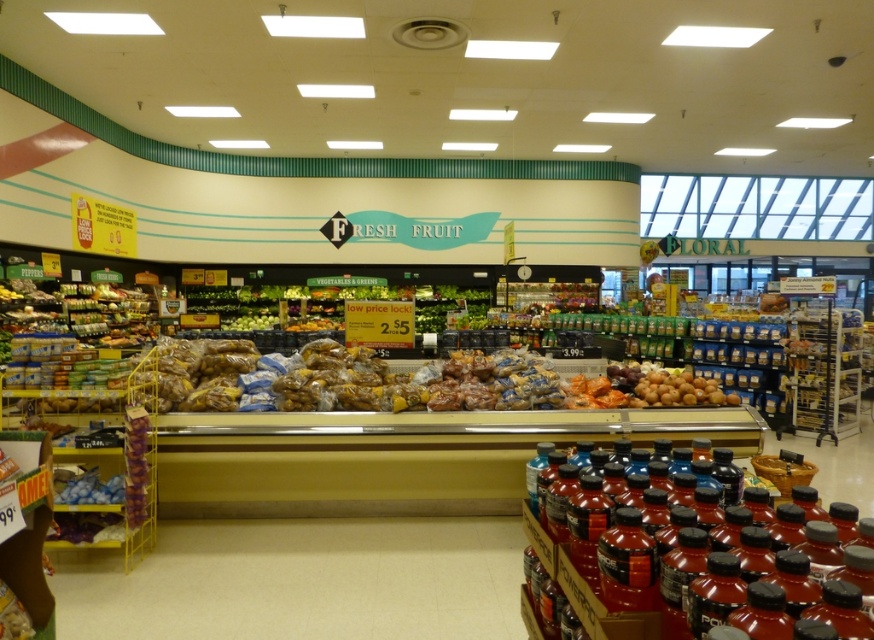
Which is more to the right, shiny red plastic bottles at lower right or shiny blue jelly beans at lower left?

Positioned to the right is shiny red plastic bottles at lower right.

Is shiny red plastic bottles at lower right to the right of shiny blue jelly beans at lower left from the viewer's perspective?

Yes, shiny red plastic bottles at lower right is to the right of shiny blue jelly beans at lower left.

Is point (538, 538) closer to camera compared to point (111, 486)?

Yes, point (538, 538) is in front of point (111, 486).

The height and width of the screenshot is (640, 874). In order to click on shiny red plastic bottles at lower right in this screenshot , I will do `click(536, 541)`.

Is shiny plastic baguette at center positioned in front of shiny red plastic bottles at lower right?

No, it is behind shiny red plastic bottles at lower right.

Based on the photo, which of these two, shiny plastic baguette at center or shiny red plastic bottles at lower right, stands taller?

Standing taller between the two is shiny red plastic bottles at lower right.

Which is behind, point (501, 355) or point (573, 579)?

The point (501, 355) is behind.

Where is `shiny plastic baguette at center`? shiny plastic baguette at center is located at coordinates (496, 381).

Who is higher up, shiny plastic baguette at center or shiny blue jelly beans at lower left?

shiny plastic baguette at center

Locate an element on the screen. The width and height of the screenshot is (874, 640). shiny plastic baguette at center is located at coordinates (496, 381).